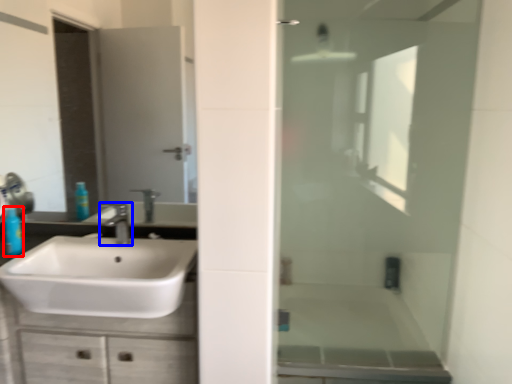
Question: Which point is closer to the camera, toiletry (highlighted by a red box) or tap (highlighted by a blue box)?

Choices:
 (A) toiletry
 (B) tap

Answer: (B)